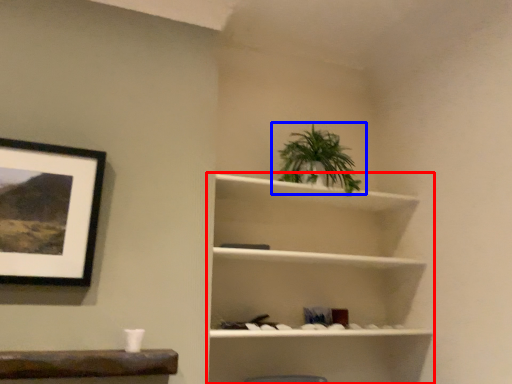
Question: Which object appears closest to the camera in this image, shelf (highlighted by a red box) or houseplant (highlighted by a blue box)?

Choices:
 (A) shelf
 (B) houseplant

Answer: (A)